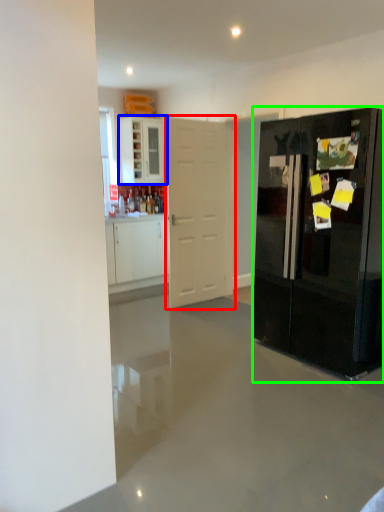
Question: Which object is the closest to the door (highlighted by a red box)? Choose among these: cabinetry (highlighted by a blue box) or refrigerator (highlighted by a green box).

Choices:
 (A) cabinetry
 (B) refrigerator

Answer: (B)